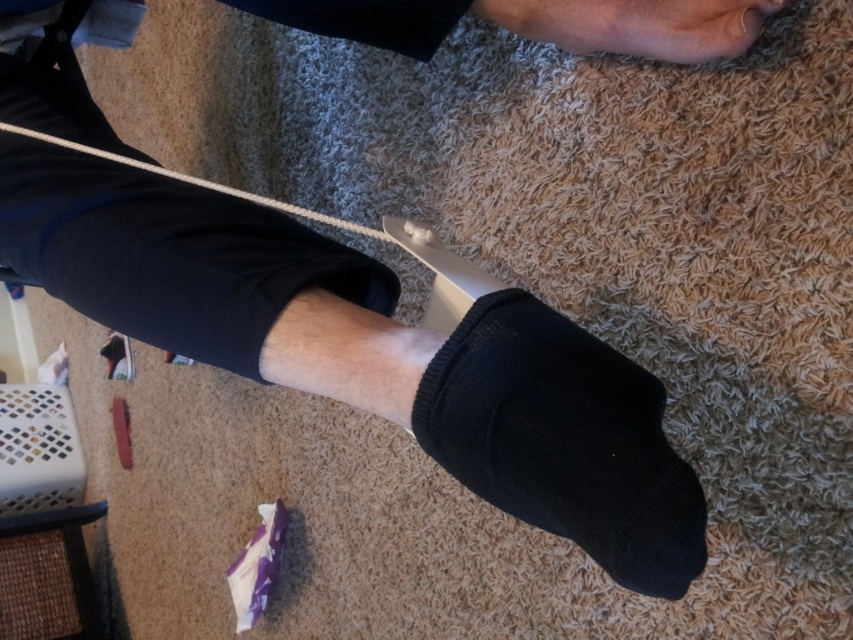
Question: Is black knitted sock at lower center to the left of matte black foot at upper right from the viewer's perspective?

Choices:
 (A) no
 (B) yes

Answer: (B)

Question: Is matte black foot at upper right to the left of white string at center from the viewer's perspective?

Choices:
 (A) yes
 (B) no

Answer: (B)

Question: Which object is positioned farthest from the matte black foot at upper right?

Choices:
 (A) black knitted sock at lower center
 (B) white string at center

Answer: (B)

Question: Can you confirm if black knitted sock at lower center is positioned to the left of white string at center?

Choices:
 (A) no
 (B) yes

Answer: (A)

Question: Among these points, which one is farthest from the camera?

Choices:
 (A) (646, 522)
 (B) (717, 1)

Answer: (B)

Question: Which object appears closest to the camera in this image?

Choices:
 (A) matte black foot at upper right
 (B) white string at center
 (C) black knitted sock at lower center

Answer: (C)